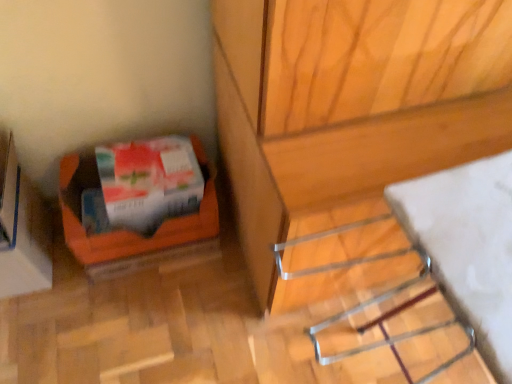
Question: Should I look upward or downward to see orange cardboard box at lower left?

Choices:
 (A) up
 (B) down

Answer: (B)

Question: Does metallic silver rack at lower right have a greater width compared to white glossy wrapping paper at lower left?

Choices:
 (A) yes
 (B) no

Answer: (A)

Question: Considering the relative sizes of metallic silver rack at lower right and white glossy wrapping paper at lower left in the image provided, is metallic silver rack at lower right smaller than white glossy wrapping paper at lower left?

Choices:
 (A) yes
 (B) no

Answer: (B)

Question: From a real-world perspective, is metallic silver rack at lower right under white glossy wrapping paper at lower left?

Choices:
 (A) no
 (B) yes

Answer: (A)

Question: Is metallic silver rack at lower right touching white glossy wrapping paper at lower left?

Choices:
 (A) no
 (B) yes

Answer: (A)

Question: Does metallic silver rack at lower right appear on the right side of white glossy wrapping paper at lower left?

Choices:
 (A) no
 (B) yes

Answer: (B)

Question: Is metallic silver rack at lower right to the left of white glossy wrapping paper at lower left from the viewer's perspective?

Choices:
 (A) yes
 (B) no

Answer: (B)

Question: Can you confirm if white glossy wrapping paper at lower left is bigger than orange cardboard box at lower left?

Choices:
 (A) yes
 (B) no

Answer: (B)

Question: Could you tell me if white glossy wrapping paper at lower left is turned towards orange cardboard box at lower left?

Choices:
 (A) no
 (B) yes

Answer: (A)

Question: From a real-world perspective, is white glossy wrapping paper at lower left over orange cardboard box at lower left?

Choices:
 (A) yes
 (B) no

Answer: (A)

Question: Considering the relative sizes of white glossy wrapping paper at lower left and orange cardboard box at lower left in the image provided, is white glossy wrapping paper at lower left taller than orange cardboard box at lower left?

Choices:
 (A) no
 (B) yes

Answer: (A)

Question: Considering the relative positions of white glossy wrapping paper at lower left and orange cardboard box at lower left in the image provided, is white glossy wrapping paper at lower left to the left of orange cardboard box at lower left from the viewer's perspective?

Choices:
 (A) yes
 (B) no

Answer: (B)

Question: Is white glossy wrapping paper at lower left outside of orange cardboard box at lower left?

Choices:
 (A) yes
 (B) no

Answer: (B)

Question: Considering the relative sizes of orange cardboard box at lower left and white glossy wrapping paper at lower left in the image provided, is orange cardboard box at lower left taller than white glossy wrapping paper at lower left?

Choices:
 (A) yes
 (B) no

Answer: (A)